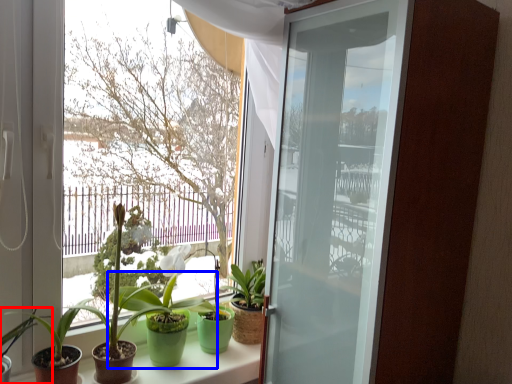
Question: Which object is closer to the camera taking this photo, houseplant (highlighted by a red box) or houseplant (highlighted by a blue box)?

Choices:
 (A) houseplant
 (B) houseplant

Answer: (A)